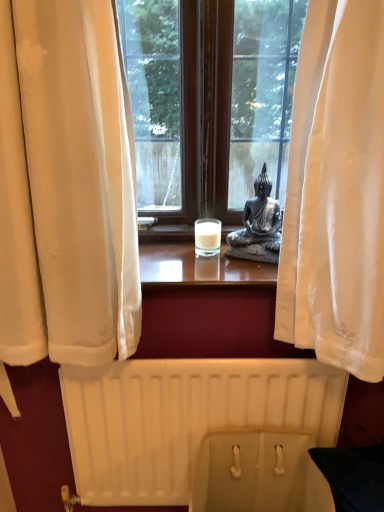
I want to click on vacant space in front of white frosted glass candle at center, so click(x=205, y=269).